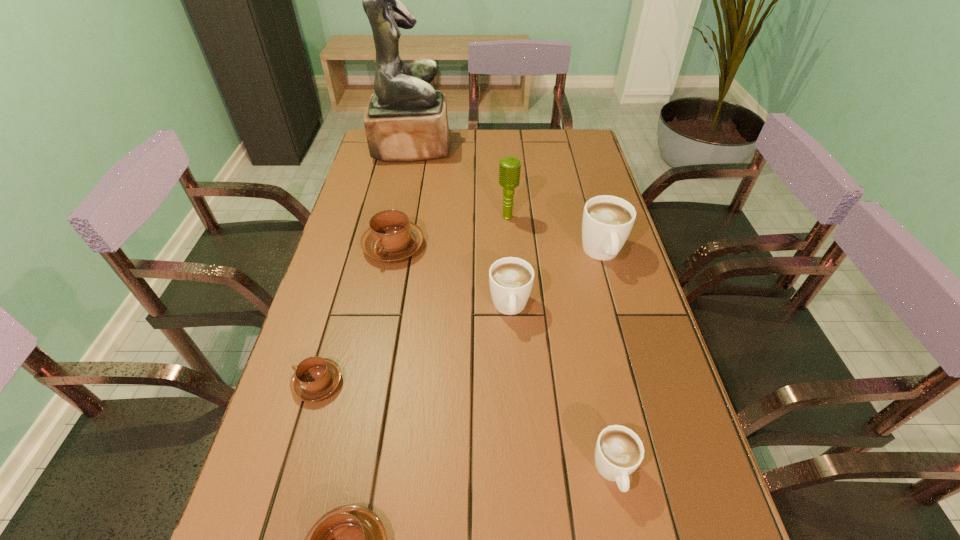
The width and height of the screenshot is (960, 540). Find the location of `the farthest object`. the farthest object is located at coordinates (406, 120).

Locate an element on the screen. This screenshot has height=540, width=960. the tallest object is located at coordinates (406, 120).

The height and width of the screenshot is (540, 960). I want to click on the seventh nearest object, so click(x=509, y=167).

I want to click on microphone, so click(x=509, y=167).

Locate an element on the screen. This screenshot has height=540, width=960. the tallest cappuccino is located at coordinates (607, 221).

Find the location of a particular element. The image size is (960, 540). the third tallest object is located at coordinates (607, 221).

You are a GUI agent. You are given a task and a screenshot of the screen. Output one action in this format:
    pyautogui.click(x=<x>, y=<y>)
    Task: Click on the leftmost white cappuccino
    
    Given the screenshot: What is the action you would take?
    pyautogui.click(x=511, y=279)

Identify the location of the second biggest white cappuccino. (511, 279).

This screenshot has width=960, height=540. In order to click on the farthest brown cappuccino in this screenshot , I will do `click(391, 237)`.

Find the location of a particular element. This screenshot has height=540, width=960. the nearest white cappuccino is located at coordinates 619,451.